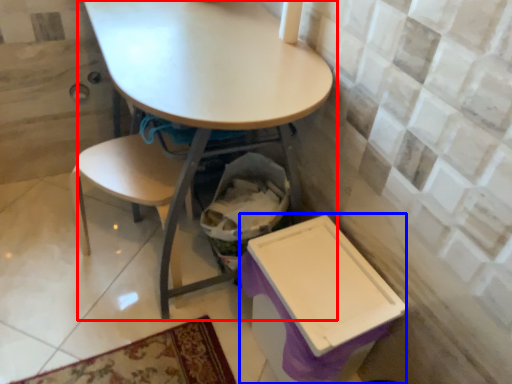
Question: Which point is closer to the camera, table (highlighted by a red box) or box (highlighted by a blue box)?

Choices:
 (A) table
 (B) box

Answer: (A)